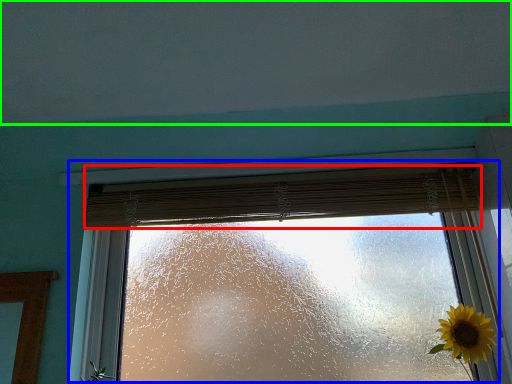
Question: Based on their relative distances, which object is farther from curtain (highlighted by a red box)? Choose from window (highlighted by a blue box) and backdrop (highlighted by a green box).

Choices:
 (A) window
 (B) backdrop

Answer: (B)